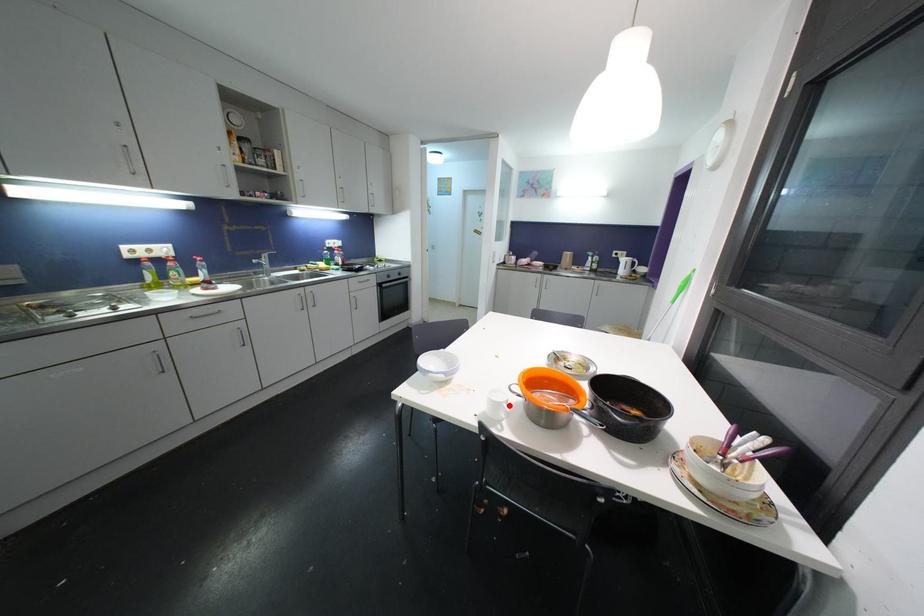
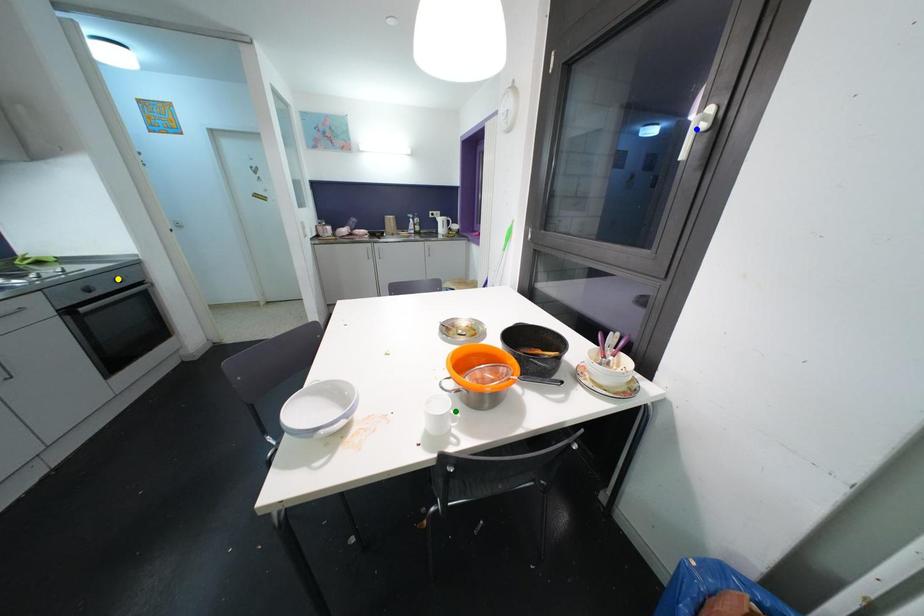
Question: I am providing you with two images of the same scene from different viewpoints. A red point is marked on the first image. You are given multiple points on the second image. In image 2, which mark is for the same physical point as the one in image 1?

Choices:
 (A) green point
 (B) blue point
 (C) yellow point

Answer: (A)